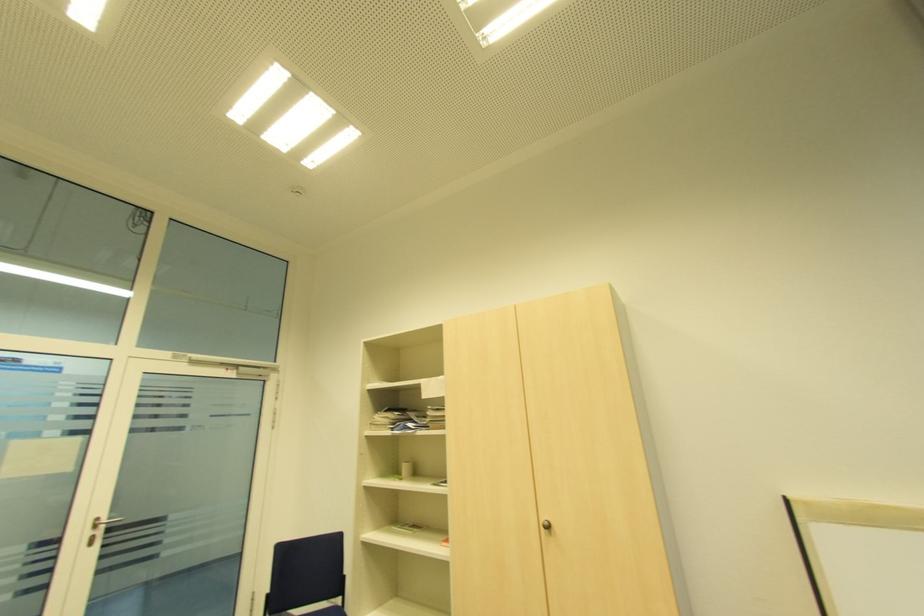
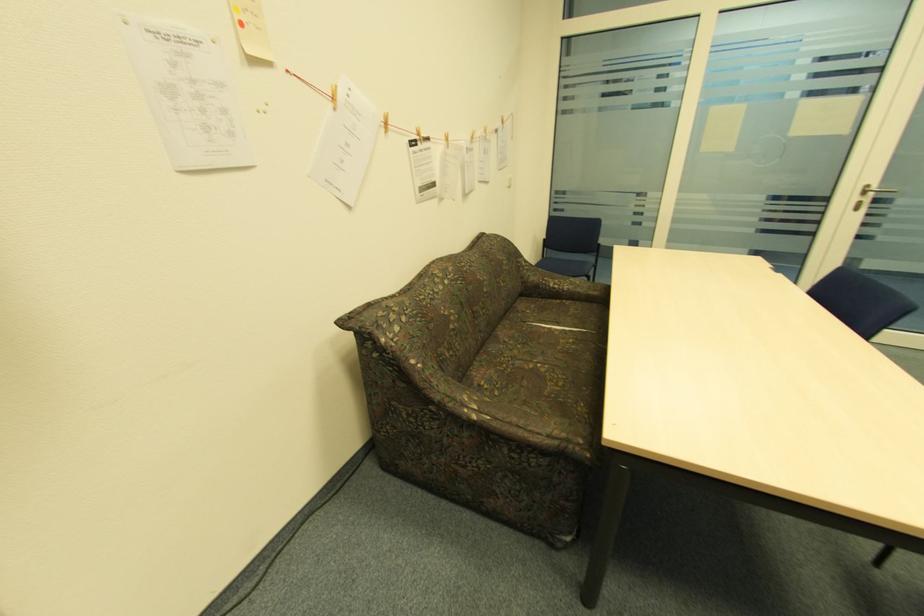
The point at (x=99, y=519) is marked in the first image. Where is the corresponding point in the second image?

(870, 187)